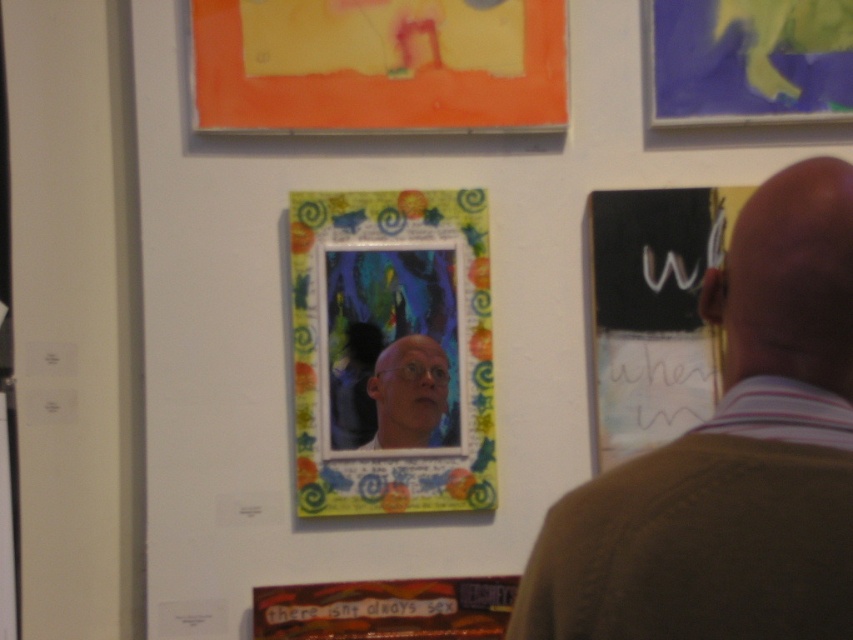
Question: Is multicolored painted frame at center thinner than matte bald man at center?

Choices:
 (A) no
 (B) yes

Answer: (A)

Question: From the image, what is the correct spatial relationship of bald head at center in relation to multicolored painted frame at center?

Choices:
 (A) above
 (B) below

Answer: (B)

Question: Which of the following is the farthest from the observer?

Choices:
 (A) matte yellow sculpture at upper right
 (B) orange matte poster at upper center
 (C) matte bald man at center

Answer: (A)

Question: Can you confirm if bald head at center is wider than multicolored painted frame at center?

Choices:
 (A) no
 (B) yes

Answer: (A)

Question: Which object is closer to the camera taking this photo?

Choices:
 (A) matte yellow sculpture at upper right
 (B) orange matte poster at upper center
 (C) matte bald man at center
 (D) multicolored painted frame at center

Answer: (D)

Question: Which point is closer to the camera taking this photo?

Choices:
 (A) (770, 628)
 (B) (473, 323)
 (C) (410, 396)

Answer: (A)